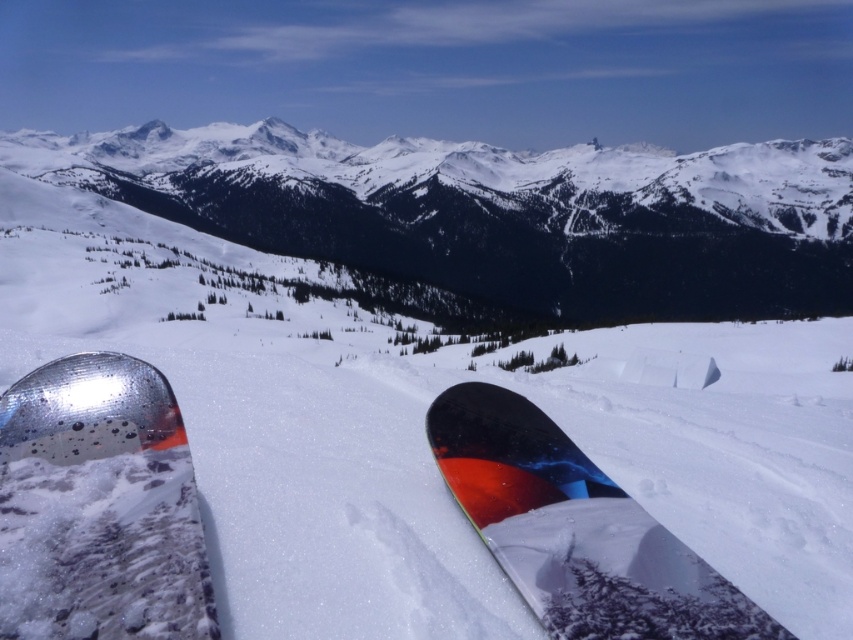
Question: Among these objects, which one is farthest from the camera?

Choices:
 (A) shiny black snowboard at center
 (B) snowy mountain range at upper center

Answer: (B)

Question: Which of the following is the closest to the observer?

Choices:
 (A) shiny black snowboard at center
 (B) snowy mountain range at upper center

Answer: (A)

Question: Where is snowy mountain range at upper center located in relation to glossy metallic snowboard at lower left in the image?

Choices:
 (A) above
 (B) below

Answer: (A)

Question: Is snowy mountain range at upper center below glossy metallic snowboard at lower left?

Choices:
 (A) no
 (B) yes

Answer: (A)

Question: Which of these objects is positioned closest to the glossy metallic snowboard at lower left?

Choices:
 (A) shiny black snowboard at center
 (B) snowy mountain range at upper center

Answer: (A)

Question: Can you confirm if glossy metallic snowboard at lower left is positioned below shiny black snowboard at center?

Choices:
 (A) yes
 (B) no

Answer: (B)